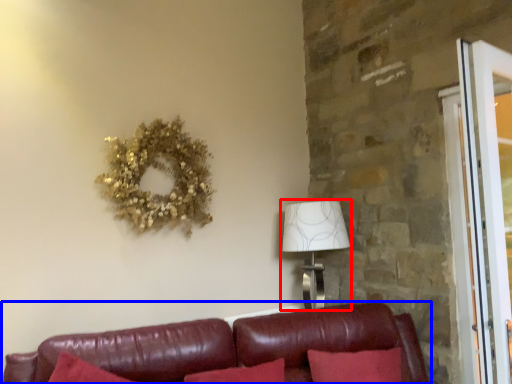
Question: Which object is closer to the camera taking this photo, table lamp (highlighted by a red box) or studio couch (highlighted by a blue box)?

Choices:
 (A) table lamp
 (B) studio couch

Answer: (B)